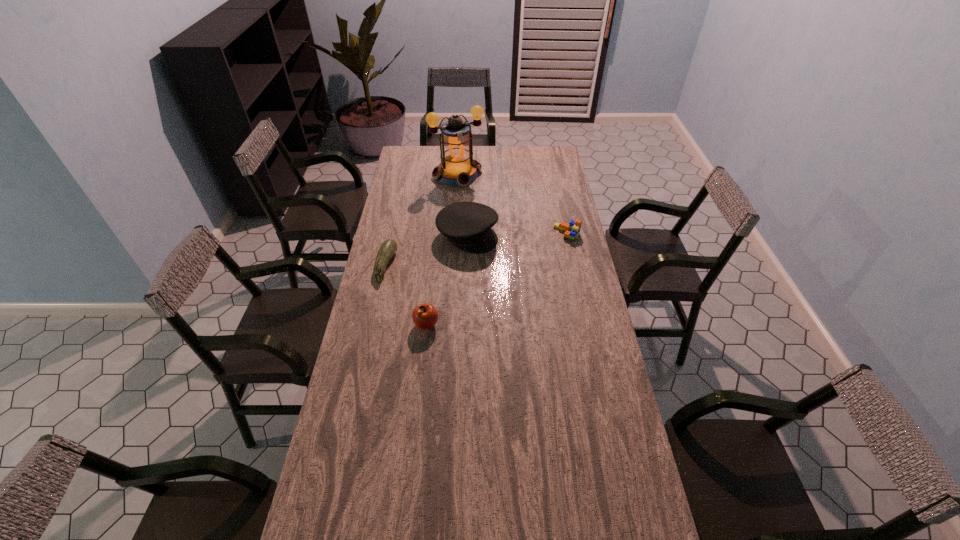
The height and width of the screenshot is (540, 960). What are the coordinates of `free space on the desktop that is between the apple and the Lego and is positioned on the front-facing side of the farthest object` in the screenshot? It's located at (513, 268).

Where is `free spot on the desktop that is between the nearest object and the rightmost object and is positioned on the front-facing side of the beret`? This screenshot has width=960, height=540. free spot on the desktop that is between the nearest object and the rightmost object and is positioned on the front-facing side of the beret is located at coordinates (522, 262).

Find the location of a particular element. vacant space on the desktop that is between the apple and the Lego and is positioned at the stem end of the leftmost object is located at coordinates (496, 279).